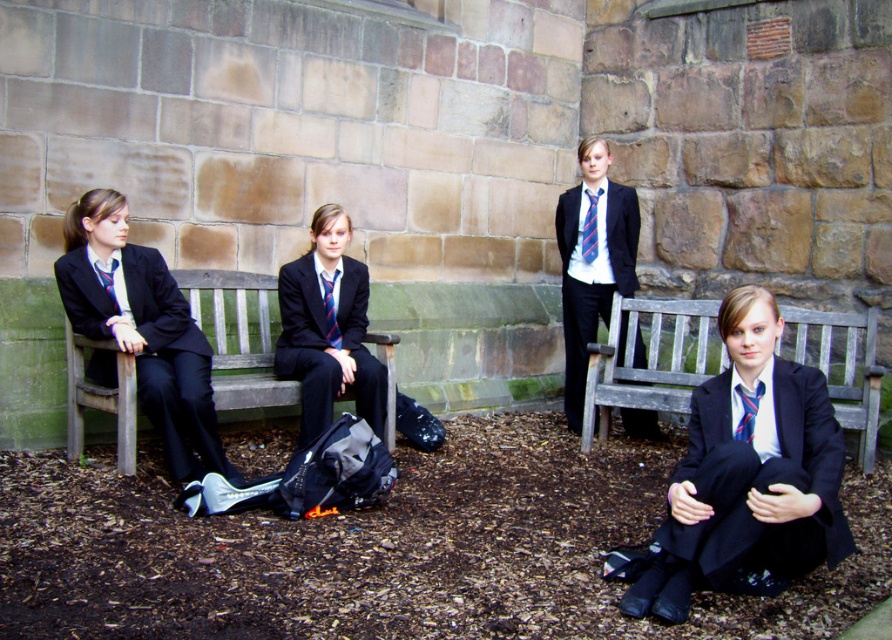
You are taking a photo of the scene and want to focus on both the point at (742, 397) and the point at (110, 266). Which point should you adjust your focus to first to ensure it is in sharp focus?

You should focus on point (742, 397) first because it is closer to the camera than point (110, 266).

Based on the scene description, where is the wooden park bench at lower right located in terms of coordinates?

The wooden park bench at lower right is located at point (651, 358).